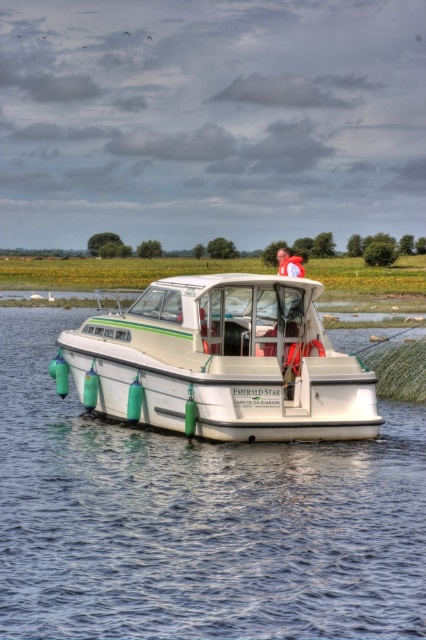
Does white glossy water at center have a greater width compared to white glossy boat at center?

Yes, white glossy water at center is wider than white glossy boat at center.

Who is taller, white glossy water at center or white glossy boat at center?

white glossy boat at center is taller.

Identify the location of white glossy water at center. This screenshot has height=640, width=426. (196, 518).

From the picture: Who is higher up, white glossy boat at center or light blue fabric shirt at center?

Positioned higher is light blue fabric shirt at center.

Does white glossy boat at center have a greater height compared to light blue fabric shirt at center?

In fact, white glossy boat at center may be shorter than light blue fabric shirt at center.

The height and width of the screenshot is (640, 426). In order to click on white glossy boat at center in this screenshot , I will do `click(222, 362)`.

Between white glossy water at center and light blue fabric shirt at center, which one is positioned lower?

white glossy water at center is lower down.

Does white glossy water at center lie in front of light blue fabric shirt at center?

Yes.

Identify the location of white glossy water at center. (196, 518).